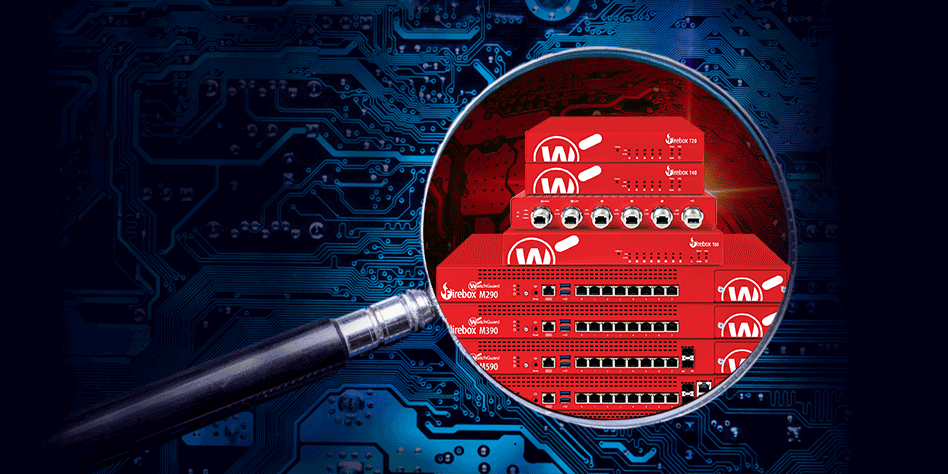
Find the location of `handle`. handle is located at coordinates (238, 370).